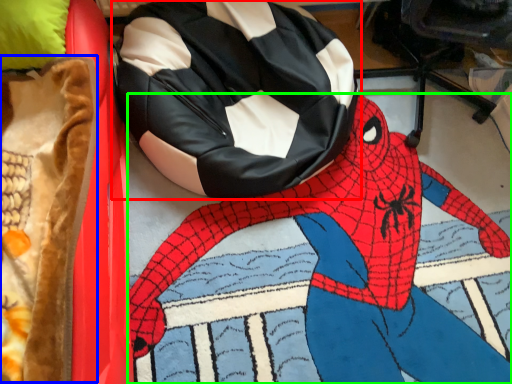
Question: Estimate the real-world distances between objects in this image. Which object is farther from bean bag chair (highlighted by a red box), blanket (highlighted by a blue box) or person (highlighted by a green box)?

Choices:
 (A) blanket
 (B) person

Answer: (A)